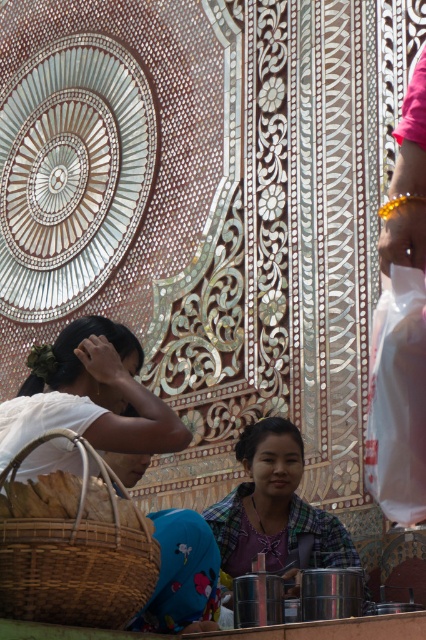
Question: Does brown woven basket at lower left appear on the right side of white matte hair at upper left?

Choices:
 (A) no
 (B) yes

Answer: (B)

Question: Which of these objects is positioned closest to the brown woven basket at lower left?

Choices:
 (A) woven bamboo basket at lower left
 (B) plaid fabric shirt at center

Answer: (A)

Question: Considering the real-world distances, which object is closest to the white matte hair at upper left?

Choices:
 (A) brown woven basket at lower left
 (B) woven bamboo basket at lower left

Answer: (A)

Question: Which object appears closest to the camera in this image?

Choices:
 (A) plaid fabric shirt at center
 (B) woven bamboo basket at lower left
 (C) brown woven basket at lower left

Answer: (C)

Question: Is white matte hair at upper left to the right of plaid fabric shirt at center from the viewer's perspective?

Choices:
 (A) no
 (B) yes

Answer: (A)

Question: Does brown woven basket at lower left appear over woven bamboo basket at lower left?

Choices:
 (A) yes
 (B) no

Answer: (B)